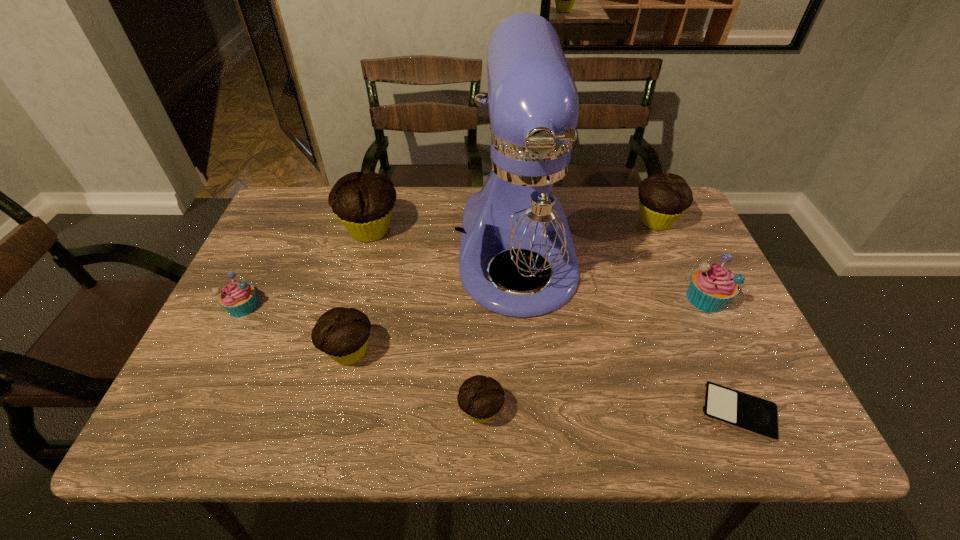
This screenshot has width=960, height=540. Find the location of `the smaller blue muffin`. the smaller blue muffin is located at coordinates (238, 298).

Where is `the nearest muffin`? the nearest muffin is located at coordinates (481, 398).

Identify the location of the smallest chocolate muffin. The image size is (960, 540). (481, 398).

In order to click on gray iPod in this screenshot , I will do `click(751, 414)`.

The image size is (960, 540). What are the coordinates of `iPod` in the screenshot? It's located at (751, 414).

Identify the location of vacant space located 0.180m at the mixing area of the tallest object. The width and height of the screenshot is (960, 540). (530, 405).

Locate an element on the screen. blank area located on the right of the tallest muffin is located at coordinates (446, 230).

At what (x,y) coordinates should I click in order to perform the action: click on vacant space located 0.300m on the left of the rightmost chocolate muffin. Please return your answer as a coordinate pair (x, y). The width and height of the screenshot is (960, 540). Looking at the image, I should click on (529, 221).

In order to click on free space located on the front of the bigger blue muffin in this screenshot , I will do `click(772, 437)`.

Locate an element on the screen. vacant space positioned on the front of the fifth farthest muffin is located at coordinates click(334, 414).